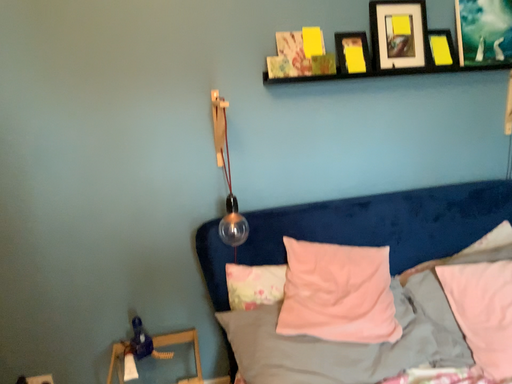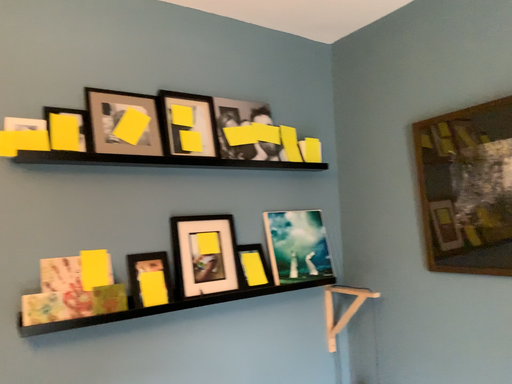
Question: How did the camera likely rotate when shooting the video?

Choices:
 (A) rotated right
 (B) rotated left

Answer: (A)